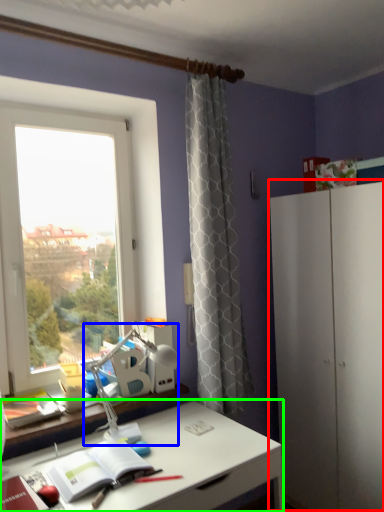
Question: Which object is positioned farthest from dresser (highlighted by a red box)? Select from table lamp (highlighted by a blue box) and desk (highlighted by a green box).

Choices:
 (A) table lamp
 (B) desk

Answer: (A)